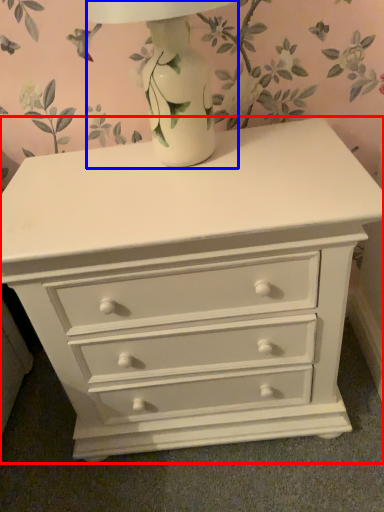
Question: Among these objects, which one is nearest to the camera, chest of drawers (highlighted by a red box) or table lamp (highlighted by a blue box)?

Choices:
 (A) chest of drawers
 (B) table lamp

Answer: (B)